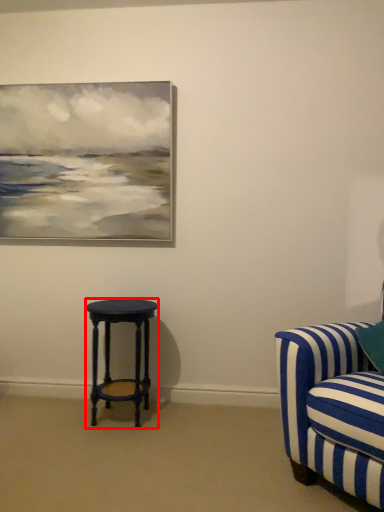
Question: Considering the relative positions of stool (annotated by the red box) and studio couch in the image provided, where is stool (annotated by the red box) located with respect to the staircase?

Choices:
 (A) right
 (B) left

Answer: (B)